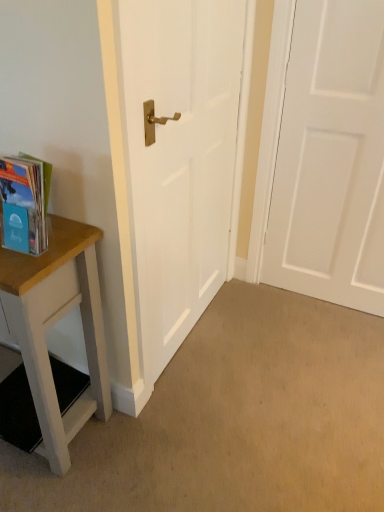
The image size is (384, 512). I want to click on free space in front of white matte door at center, which appears as the 2th door when viewed from the right, so click(216, 428).